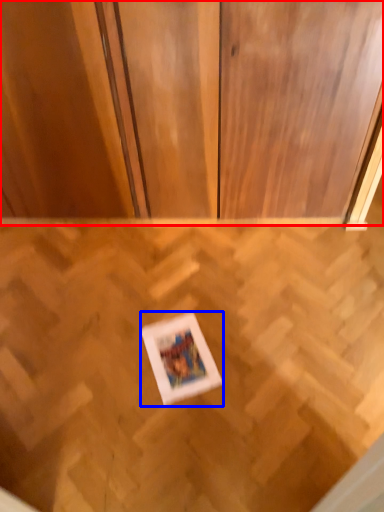
Question: Which object appears closest to the camera in this image, dresser (highlighted by a red box) or picture frame (highlighted by a blue box)?

Choices:
 (A) dresser
 (B) picture frame

Answer: (A)